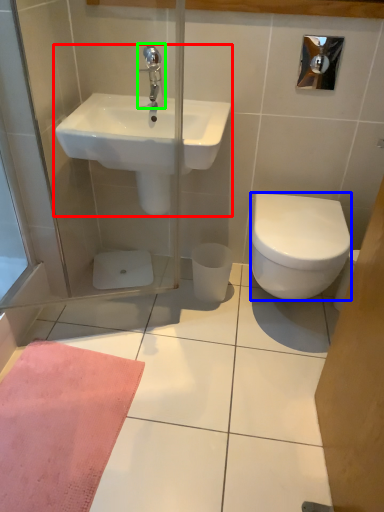
Question: Based on their relative distances, which object is nearer to sink (highlighted by a red box)? Choose from bidet (highlighted by a blue box) and tap (highlighted by a green box).

Choices:
 (A) bidet
 (B) tap

Answer: (B)